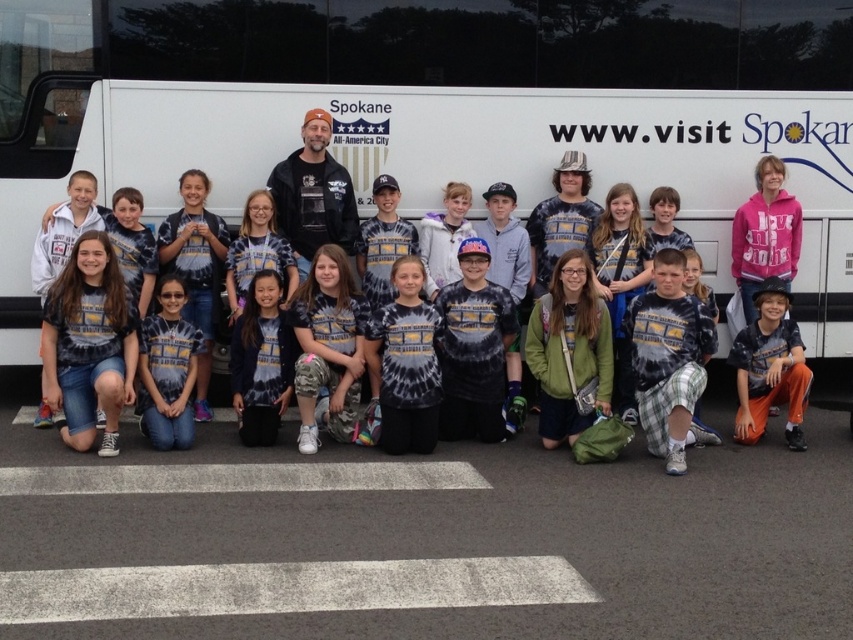
Can you confirm if tie-dye shirt at lower left is positioned above tie-dye shirt at center?

Indeed, tie-dye shirt at lower left is positioned over tie-dye shirt at center.

Does point (90, 243) lie behind point (380, 406)?

No, it is in front of (380, 406).

This screenshot has height=640, width=853. I want to click on tie-dye shirt at lower left, so click(90, 342).

Between point (573, 419) and point (780, 337), which one is positioned behind?

The point (780, 337) is more distant.

Between point (543, 298) and point (808, 381), which one is positioned behind?

The point (543, 298) is more distant.

Where is `green matte jacket at center`? green matte jacket at center is located at coordinates (570, 352).

Does green matte jacket at center appear on the left side of tie-dye shirt at center?

No, green matte jacket at center is not to the left of tie-dye shirt at center.

Looking at this image, which of these two, green matte jacket at center or tie-dye shirt at center, stands taller?

green matte jacket at center is taller.

What are the coordinates of `green matte jacket at center` in the screenshot? It's located at (570, 352).

You are a GUI agent. You are given a task and a screenshot of the screen. Output one action in this format:
    pyautogui.click(x=<x>, y=<y>)
    Task: Click on the green matte jacket at center
    The height and width of the screenshot is (640, 853).
    Given the screenshot: What is the action you would take?
    pyautogui.click(x=570, y=352)